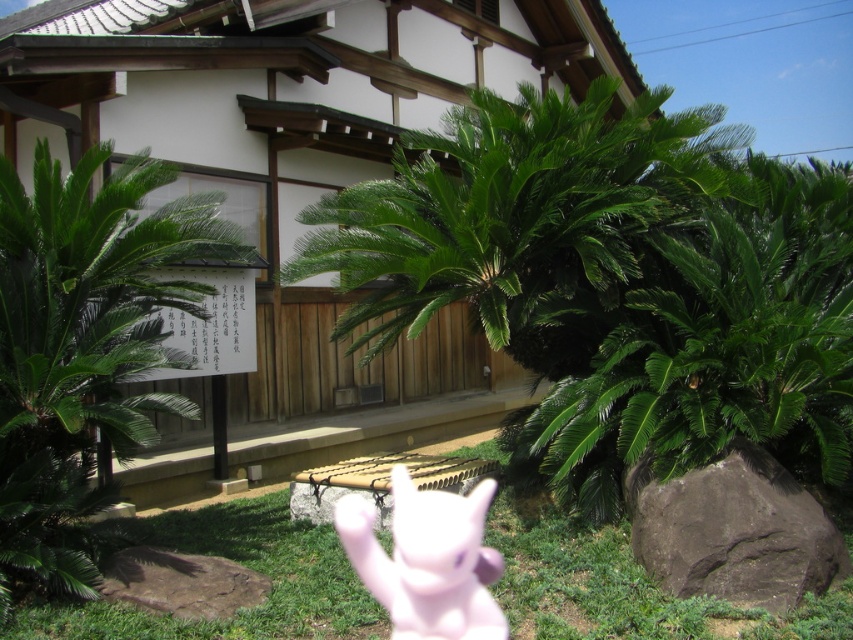
Question: Which of the following is the farthest from the observer?

Choices:
 (A) (424, 506)
 (B) (337, 556)
 (C) (49, 552)

Answer: (A)

Question: Which object appears farthest from the camera in this image?

Choices:
 (A) green leafy palm tree at left
 (B) green grass at lower center
 (C) pink rubber toy at center

Answer: (C)

Question: Does green grass at lower center have a greater width compared to pink rubber toy at center?

Choices:
 (A) no
 (B) yes

Answer: (B)

Question: Does green leafy palm tree at left have a smaller size compared to pink rubber toy at center?

Choices:
 (A) yes
 (B) no

Answer: (B)

Question: Can you confirm if green leafy palm tree at left is wider than pink rubber toy at center?

Choices:
 (A) yes
 (B) no

Answer: (B)

Question: Which object is positioned closest to the green leafy palm tree at left?

Choices:
 (A) green grass at lower center
 (B) pink rubber toy at center

Answer: (A)